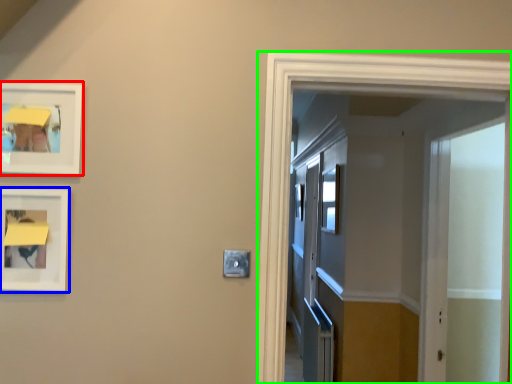
Question: Estimate the real-world distances between objects in this image. Which object is closer to picture frame (highlighted by a red box), picture frame (highlighted by a blue box) or elevator (highlighted by a green box)?

Choices:
 (A) picture frame
 (B) elevator

Answer: (A)